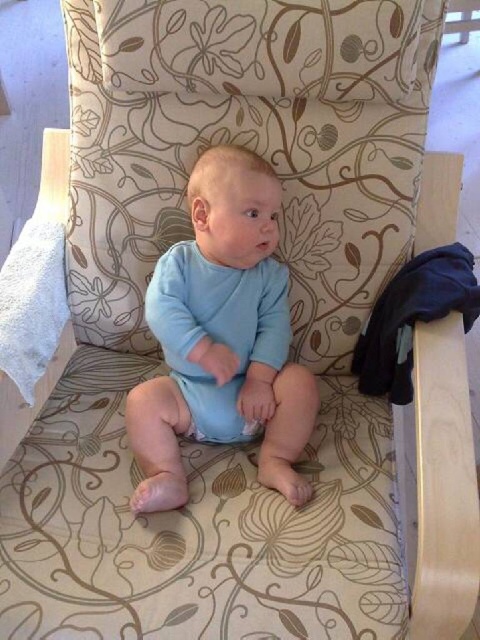
Question: Can you confirm if smooth blue onesie at center is positioned to the left of blue soft diaper at center?

Choices:
 (A) yes
 (B) no

Answer: (B)

Question: Which object appears closest to the camera in this image?

Choices:
 (A) smooth blue onesie at center
 (B) blue soft diaper at center

Answer: (A)

Question: Is smooth blue onesie at center positioned behind blue soft diaper at center?

Choices:
 (A) yes
 (B) no

Answer: (B)

Question: Is smooth blue onesie at center to the right of blue soft diaper at center from the viewer's perspective?

Choices:
 (A) no
 (B) yes

Answer: (B)

Question: Which object appears closest to the camera in this image?

Choices:
 (A) smooth blue onesie at center
 (B) blue soft diaper at center

Answer: (A)